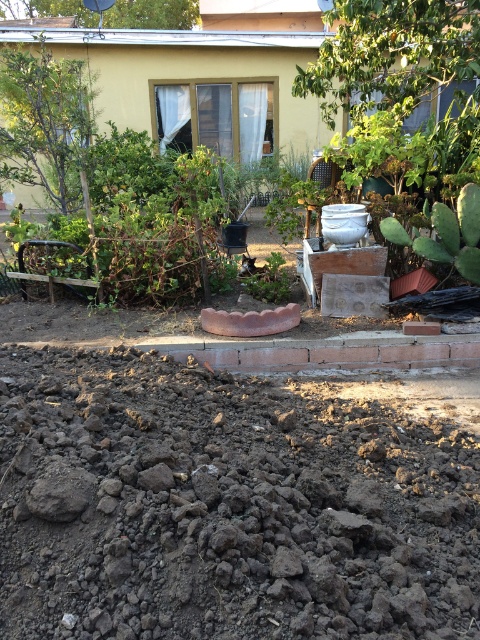
You are a gardener who needs to water both the green spiky cactus at right and the green matte plant at center. The watering can you have can hold enough water for a 1.5 meter distance. Do you need to refill the watering can before moving from the cactus to the plant?

The green spiky cactus at right is 1.43 meters from the green matte plant at center. Since the distance is less than 1.5 meters, you don not need to refill the watering can before moving from the cactus to the plant.

From the picture: You are a gardener who wants to plant a new flower that requires at least 1 meter of height clearance. Looking at the garden scene, which plant between the green spiky cactus at right and the green matte plant at center would you need to consider for potential shading issues?

The green spiky cactus at right is much taller than the green matte plant at center, so it would cast more shade and should be considered for potential shading issues when planting the new flower.

What is the 2D coordinate of the dull brown soil at lower center in the garden scene?

The 2D coordinate of the dull brown soil at lower center is at point (225, 506).